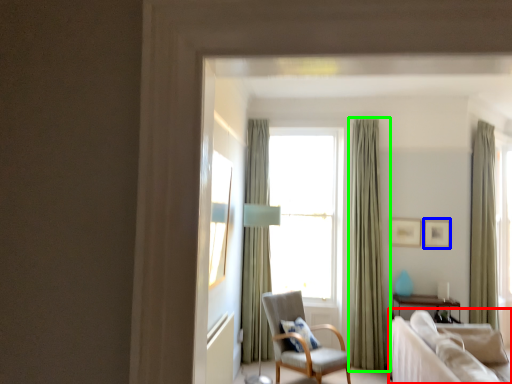
Question: Which object is the farthest from studio couch (highlighted by a red box)? Choose among these: picture frame (highlighted by a blue box) or curtain (highlighted by a green box).

Choices:
 (A) picture frame
 (B) curtain

Answer: (A)